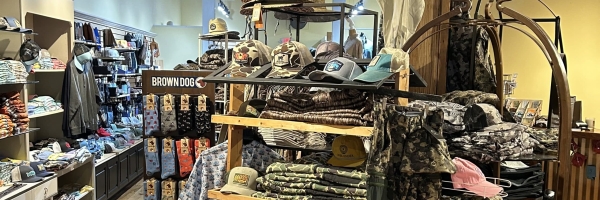
The height and width of the screenshot is (200, 600). What are the coordinates of `empty wall space` in the screenshot? It's located at (123, 7), (572, 30).